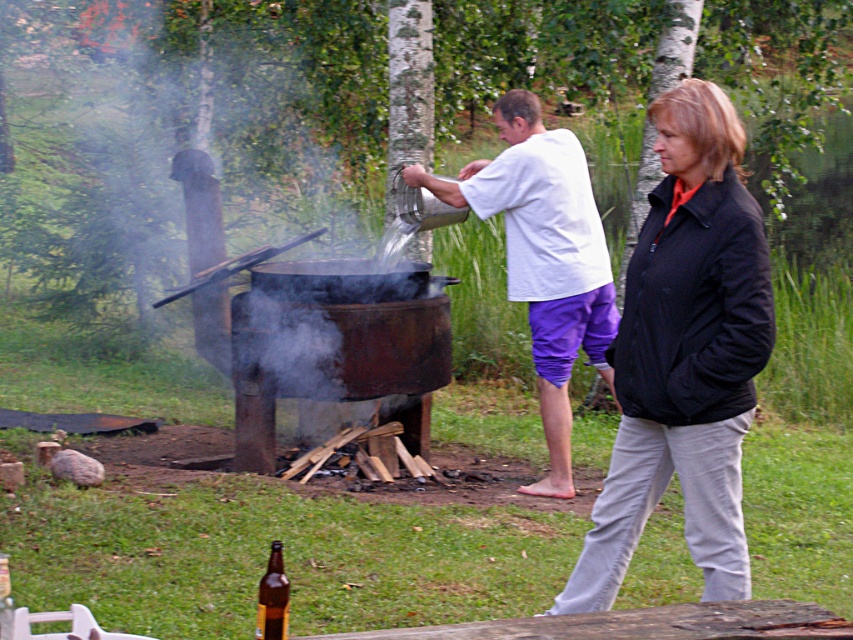
Question: Based on their relative distances, which object is nearer to the brown glass bottle at lower left?

Choices:
 (A) black jacket at center
 (B) white matte shirt at center

Answer: (A)

Question: Which object is positioned farthest from the white matte shirt at center?

Choices:
 (A) black jacket at center
 (B) brown glass bottle at lower left

Answer: (B)

Question: Can you confirm if white matte shirt at center is positioned to the right of brown glass bottle at lower left?

Choices:
 (A) yes
 (B) no

Answer: (A)

Question: Among these objects, which one is farthest from the camera?

Choices:
 (A) black jacket at center
 (B) brown glass bottle at lower left

Answer: (A)

Question: Does black jacket at center lie behind white matte shirt at center?

Choices:
 (A) no
 (B) yes

Answer: (A)

Question: Can you confirm if white matte shirt at center is smaller than brown glass bottle at lower left?

Choices:
 (A) no
 (B) yes

Answer: (A)